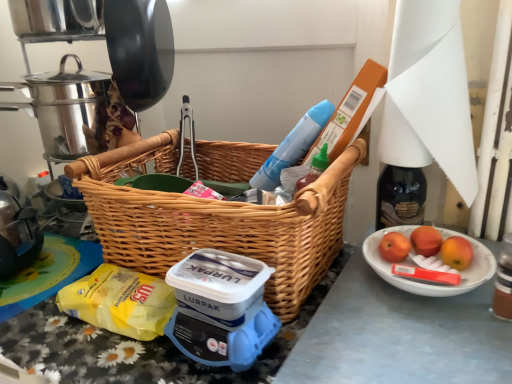
Question: Does red matte apple at right, the second apple in the right-to-left sequence, have a greater width compared to yellow plastic bag at lower left?

Choices:
 (A) yes
 (B) no

Answer: (B)

Question: Would you say red matte apple at right, the second apple in the right-to-left sequence, contains yellow plastic bag at lower left?

Choices:
 (A) yes
 (B) no

Answer: (B)

Question: Can you confirm if red matte apple at right, the second apple when ordered from left to right, is smaller than yellow plastic bag at lower left?

Choices:
 (A) no
 (B) yes

Answer: (B)

Question: From a real-world perspective, is red matte apple at right, the second apple when ordered from left to right, positioned under yellow plastic bag at lower left based on gravity?

Choices:
 (A) yes
 (B) no

Answer: (B)

Question: From the image's perspective, does red matte apple at right, the second apple in the right-to-left sequence, appear lower than yellow plastic bag at lower left?

Choices:
 (A) yes
 (B) no

Answer: (B)

Question: Is red matte apple at right, the second apple when ordered from left to right, far from yellow plastic bag at lower left?

Choices:
 (A) yes
 (B) no

Answer: (B)

Question: Can you confirm if red matte apple at right, positioned as the first apple in right-to-left order, is wider than yellow plastic bag at lower left?

Choices:
 (A) no
 (B) yes

Answer: (A)

Question: Can we say red matte apple at right, positioned as the third apple in left-to-right order, lies outside yellow plastic bag at lower left?

Choices:
 (A) yes
 (B) no

Answer: (A)

Question: Is red matte apple at right, positioned as the third apple in left-to-right order, smaller than yellow plastic bag at lower left?

Choices:
 (A) yes
 (B) no

Answer: (A)

Question: Is there a large distance between red matte apple at right, positioned as the first apple in right-to-left order, and yellow plastic bag at lower left?

Choices:
 (A) no
 (B) yes

Answer: (A)

Question: Can you confirm if red matte apple at right, positioned as the first apple in right-to-left order, is taller than yellow plastic bag at lower left?

Choices:
 (A) yes
 (B) no

Answer: (B)

Question: Is red matte apple at right, positioned as the first apple in right-to-left order, at the left side of yellow plastic bag at lower left?

Choices:
 (A) yes
 (B) no

Answer: (B)

Question: Does woven wood picnic basket at center have a greater height compared to white ceramic bowl at lower right?

Choices:
 (A) yes
 (B) no

Answer: (A)